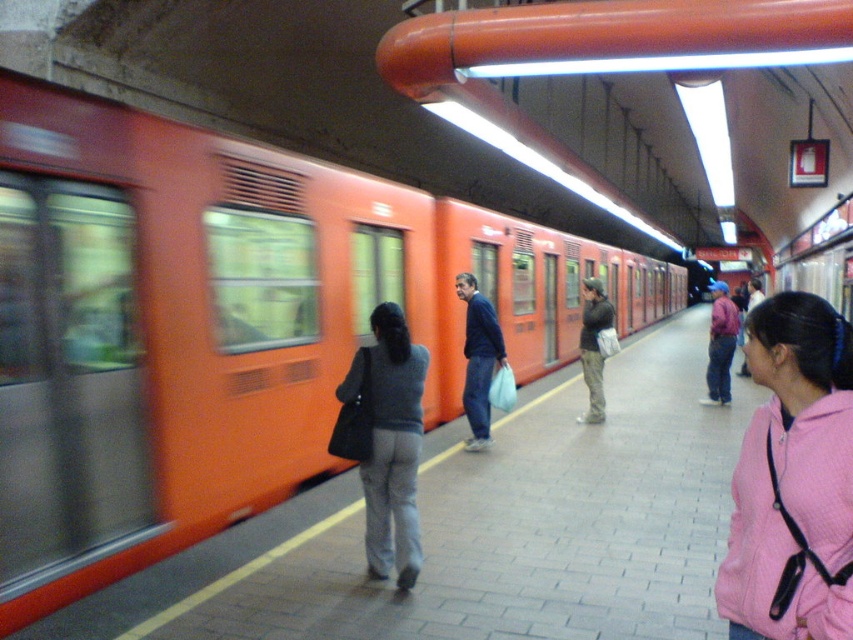
You are standing at the subway station and want to take a photo of both point (753, 563) and point (596, 301) in the scene. Which point should you focus on first to ensure both are in clear view?

You should focus on point (753, 563) first because it is closer to the camera than point (596, 301), ensuring both points are in clear view.

You are standing on the subway platform and notice two people wearing jackets. The pink fleece jacket at lower right and the matte black jacket at center. Which jacket is shorter in height?

The pink fleece jacket at lower right has a lesser height compared to the matte black jacket at center, so the pink fleece jacket at lower right is shorter in height.

You are standing at the subway station and want to board the orange matte train at left. The platform has a safety line 2 meters away from the train. Are you currently standing behind the safety line?

The orange matte train at left is 3.70 meters away from you. Since the safety line is only 2 meters away from the train, you are standing 1.70 meters behind the safety line.